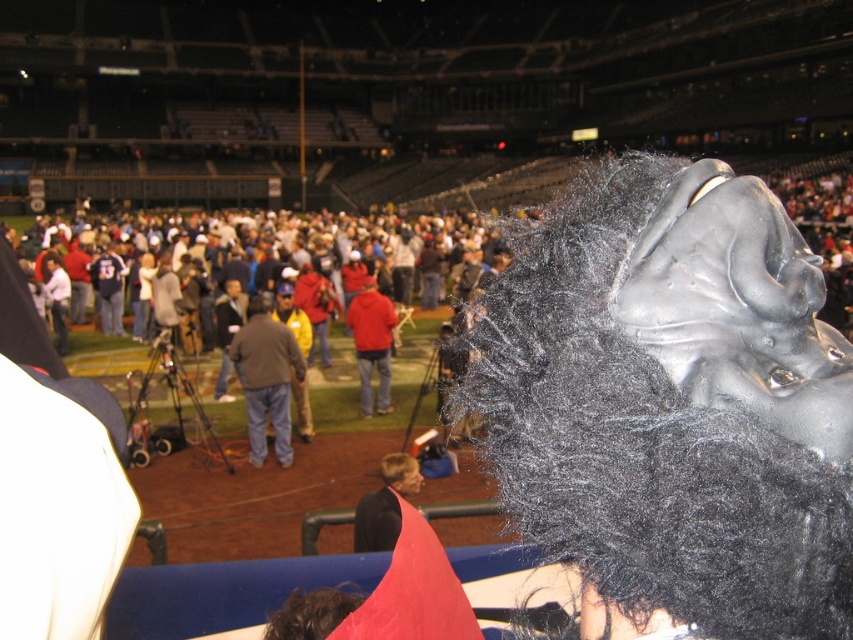
You are a photographer at the baseball stadium event. You need to capture both the brown leather jacket at center and the red matte jacket at center in a single frame. Which jacket should you focus on to ensure both are fully visible without cropping?

The brown leather jacket at center is wider than the red matte jacket at center, so focusing on the brown leather jacket at center will ensure both are fully visible without cropping.

You are a photographer at the baseball stadium event. You want to take a photo of the matte red jacket at center without the shiny metallic gorilla head at upper right blocking it. Is this possible?

The shiny metallic gorilla head at upper right is closer to the viewer than the matte red jacket at center, so it would block the view of the matte red jacket at center. Therefore, it is not possible to take a photo of the matte red jacket at center without the shiny metallic gorilla head at upper right blocking it.